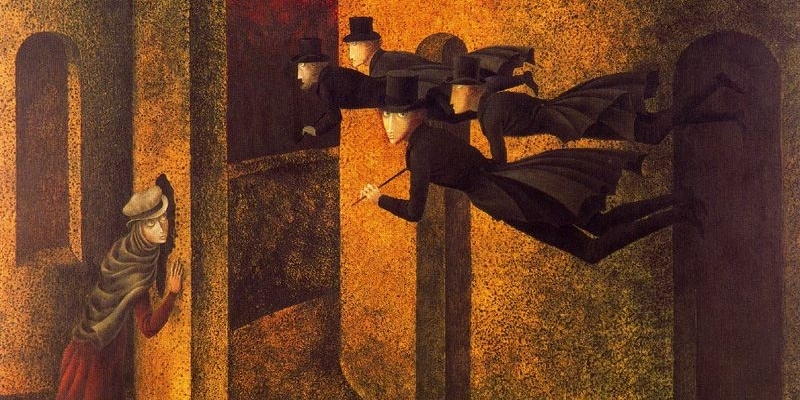
You are a GUI agent. You are given a task and a screenshot of the screen. Output one action in this format:
    pyautogui.click(x=<x>, y=<y>)
    Task: Click on the window sill
    
    Given the screenshot: What is the action you would take?
    pos(53,256)